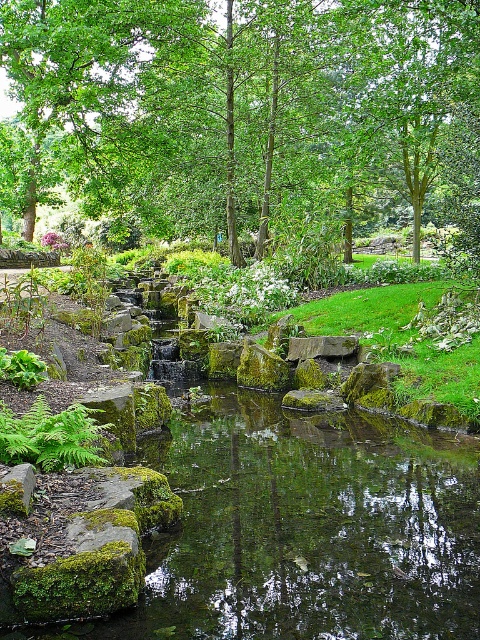
Question: Which is farther from the green mossy stone at center?

Choices:
 (A) green matte fern at lower left
 (B) green leafy tree at upper center

Answer: (B)

Question: Which point appears closest to the camera in this image?

Choices:
 (A) (208, 129)
 (B) (337, 355)

Answer: (B)

Question: Considering the relative positions of green matte fern at lower left and green mossy stone at center in the image provided, where is green matte fern at lower left located with respect to green mossy stone at center?

Choices:
 (A) left
 (B) right

Answer: (A)

Question: Is the position of green leafy tree at upper center more distant than that of green matte fern at lower left?

Choices:
 (A) no
 (B) yes

Answer: (B)

Question: From the image, what is the correct spatial relationship of green leafy tree at upper center in relation to green mossy stone at center?

Choices:
 (A) right
 (B) left

Answer: (B)

Question: Which of the following is the closest to the observer?

Choices:
 (A) green matte fern at lower left
 (B) green leafy tree at upper center

Answer: (A)